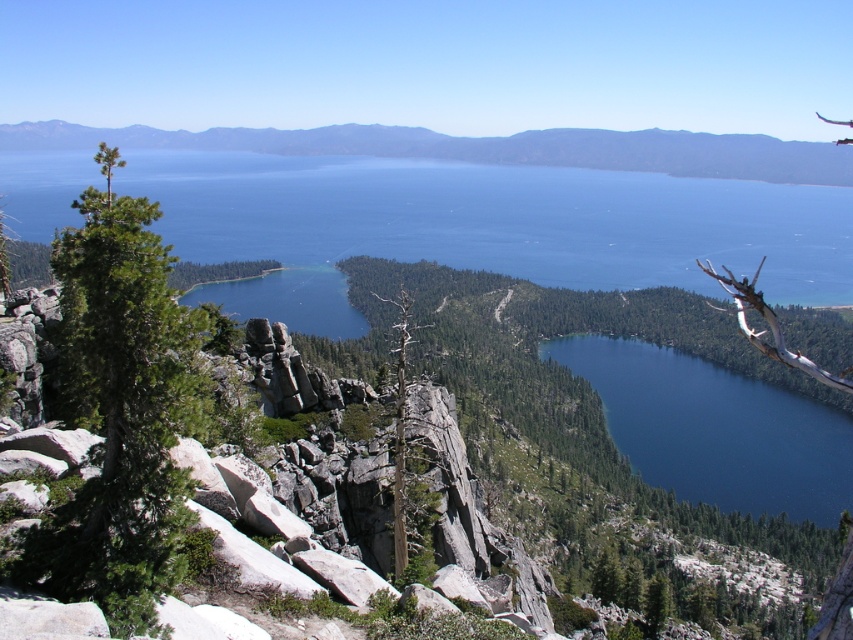
Question: Which point is closer to the camera?

Choices:
 (A) gray bark branch at center
 (B) green needle-like tree at left
 (C) deep blue water at center
 (D) dead wood tree at center

Answer: (B)

Question: Which object is farther from the camera taking this photo?

Choices:
 (A) green needle-like tree at left
 (B) green textured rock at upper center
 (C) dead wood tree at center

Answer: (B)

Question: Does deep blue water at center have a greater width compared to dead wood tree at center?

Choices:
 (A) yes
 (B) no

Answer: (A)

Question: Does green needle-like tree at left appear under gray bark branch at center?

Choices:
 (A) no
 (B) yes

Answer: (B)

Question: From the image, what is the correct spatial relationship of deep blue water at center in relation to green textured rock at upper center?

Choices:
 (A) below
 (B) above

Answer: (A)

Question: Among these points, which one is nearest to the camera?

Choices:
 (A) (103, 401)
 (B) (71, 125)

Answer: (A)